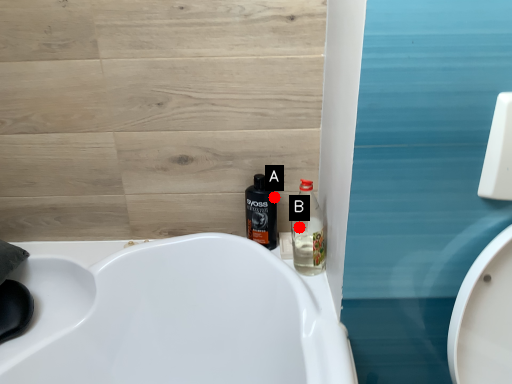
Question: Two points are circled on the image, labeled by A and B beside each circle. Which point is farther from the camera taking this photo?

Choices:
 (A) A is further
 (B) B is further

Answer: (B)